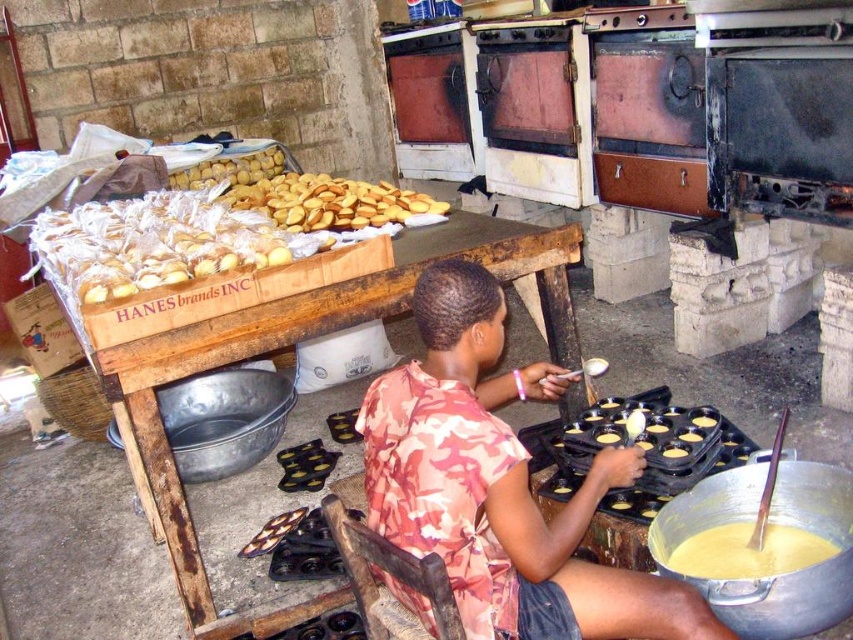
Question: Among these points, which one is farthest from the camera?

Choices:
 (A) (674, 449)
 (B) (691, 554)
 (C) (447, 282)

Answer: (A)

Question: Among these points, which one is farthest from the camera?

Choices:
 (A) (201, 168)
 (B) (288, 525)

Answer: (A)

Question: Can you confirm if wooden at upper center is smaller than white wrapped cookies at upper left?

Choices:
 (A) no
 (B) yes

Answer: (A)

Question: Which point appears farthest from the camera in this image?

Choices:
 (A) [679, 456]
 (B) [715, 548]
 (C) [252, 168]

Answer: (C)

Question: Can you confirm if pink camouflage shirt at center is positioned to the right of white wrapped cookies at upper left?

Choices:
 (A) yes
 (B) no

Answer: (A)

Question: Does pink camouflage shirt at center come behind yellow matte cookies at upper left?

Choices:
 (A) yes
 (B) no

Answer: (B)